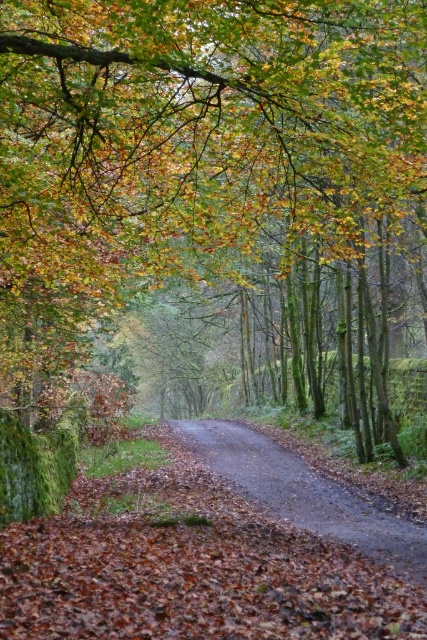
Question: Is green leafy tree at center smaller than damp asphalt road at center?

Choices:
 (A) no
 (B) yes

Answer: (A)

Question: Where is green leafy tree at center located in relation to damp asphalt road at center in the image?

Choices:
 (A) above
 (B) below

Answer: (A)

Question: Which of the following is the farthest from the observer?

Choices:
 (A) (324, 529)
 (B) (40, 61)

Answer: (A)

Question: Can you confirm if green leafy tree at center is positioned to the right of damp asphalt road at center?

Choices:
 (A) no
 (B) yes

Answer: (B)